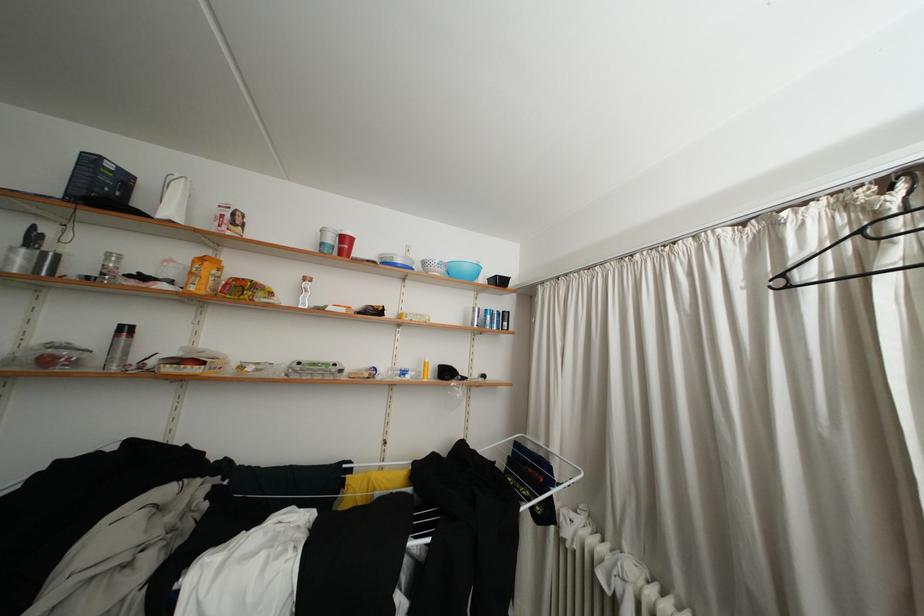
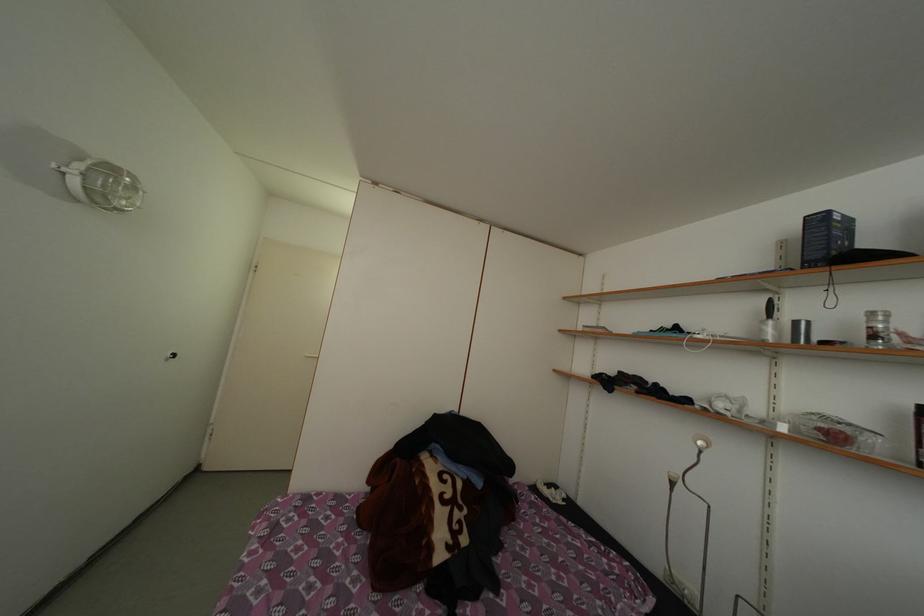
Question: The first image is from the beginning of the video and the second image is from the end. How did the camera likely rotate when shooting the video?

Choices:
 (A) Left
 (B) Right
 (C) Up
 (D) Down

Answer: (A)